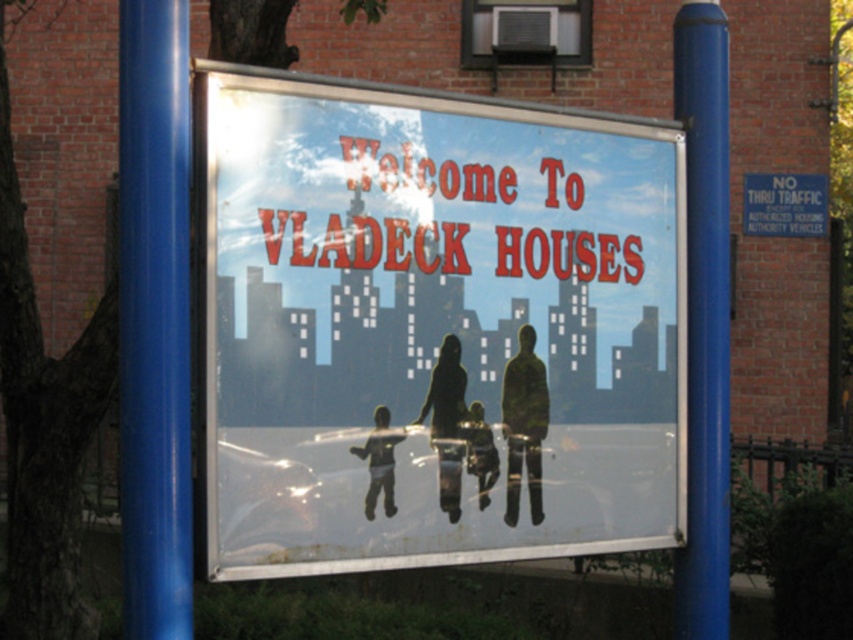
Between metallic rectangular sign at upper right and matte black shirt at lower left, which one is positioned lower?

matte black shirt at lower left

Between point (793, 205) and point (386, 413), which one is positioned in front?

Point (386, 413) is in front.

Between point (790, 173) and point (386, 476), which one is positioned behind?

The point (790, 173) is more distant.

This screenshot has height=640, width=853. Find the location of `metallic rectangular sign at upper right`. metallic rectangular sign at upper right is located at coordinates (785, 204).

Is the position of silhouette figure at center more distant than that of matte black shirt at lower left?

Yes, it is.

Does silhouette figure at center have a lesser width compared to matte black shirt at lower left?

Indeed, silhouette figure at center has a lesser width compared to matte black shirt at lower left.

Between point (538, 512) and point (352, 449), which one is positioned behind?

Point (538, 512)

The height and width of the screenshot is (640, 853). Find the location of `silhouette figure at center`. silhouette figure at center is located at coordinates (524, 422).

Can you confirm if blue glossy pole at center is positioned to the left of smooth plastic child at center?

Yes, blue glossy pole at center is to the left of smooth plastic child at center.

Which is in front, point (172, 269) or point (468, 429)?

Point (172, 269) is more forward.

What are the coordinates of `blue glossy pole at center` in the screenshot? It's located at (154, 317).

Identify the location of blue glossy pole at center. This screenshot has width=853, height=640. (154, 317).